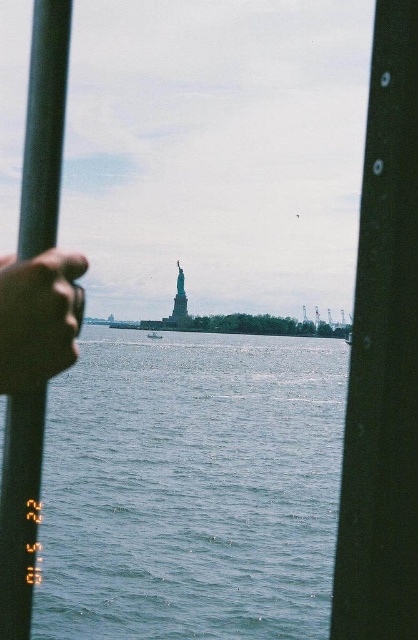
You are standing at the camera position and want to know how far the point at coordinates (272, 428) is from you. Can you determine the distance?

The point at coordinates (272, 428) is 421.31 meters away from the camera position.

You are a photographer trying to capture a clear shot of the Statue of Liberty in the background. You notice a black matte pole at center and a smooth skin hand at center left in your frame. Which object should you move to avoid blocking your view of the Statue of Liberty?

The black matte pole at center is in front of the smooth skin hand at center left, so you should move the black matte pole at center to avoid blocking your view of the Statue of Liberty.